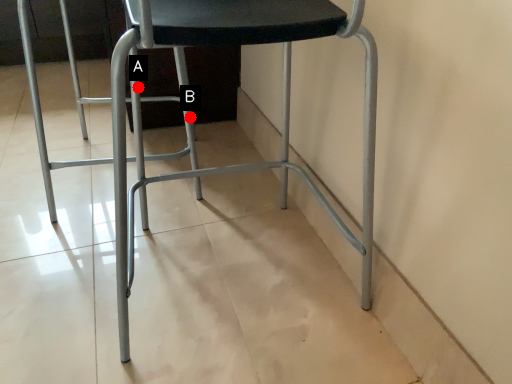
Question: Two points are circled on the image, labeled by A and B beside each circle. Which point appears closest to the camera in this image?

Choices:
 (A) A is closer
 (B) B is closer

Answer: (A)